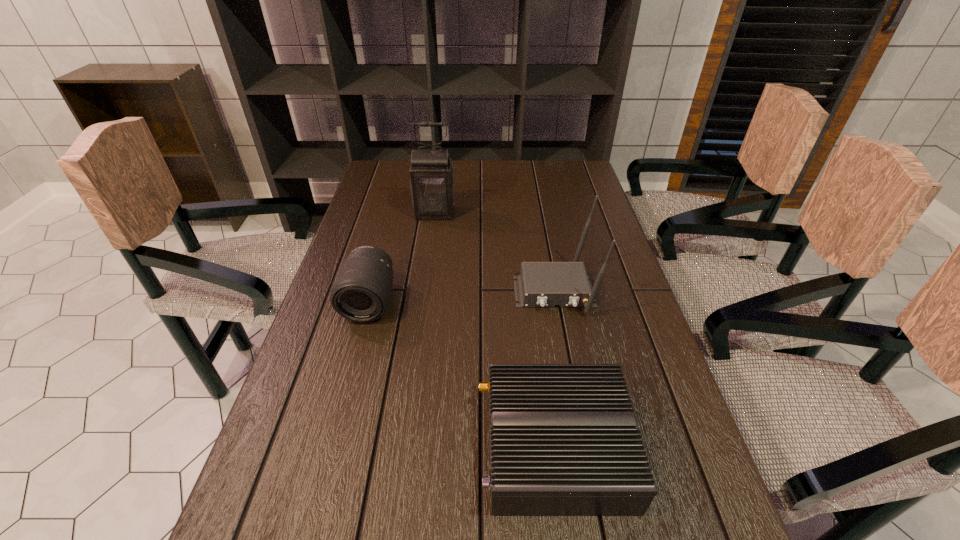
The width and height of the screenshot is (960, 540). Find the location of `vacant space that's between the farther router and the farthest object`. vacant space that's between the farther router and the farthest object is located at coordinates (494, 252).

Locate an element on the screen. The image size is (960, 540). vacant space in between the shortest object and the third object from right to left is located at coordinates (495, 329).

You are a GUI agent. You are given a task and a screenshot of the screen. Output one action in this format:
    pyautogui.click(x=<x>, y=<y>)
    Task: Click on the free space between the nearer router and the third object from right to left
    
    Given the screenshot: What is the action you would take?
    pyautogui.click(x=495, y=329)

Identify the location of free point between the taller router and the third tallest object. This screenshot has width=960, height=540. (462, 296).

This screenshot has width=960, height=540. Find the location of `unoccupied position between the third shortest object and the leftmost object`. unoccupied position between the third shortest object and the leftmost object is located at coordinates (462, 296).

At what (x,y) coordinates should I click in order to perform the action: click on object that stands as the closest to the farthest object. Please return your answer as a coordinate pair (x, y). Image resolution: width=960 pixels, height=540 pixels. Looking at the image, I should click on (361, 292).

The height and width of the screenshot is (540, 960). Find the location of `the second closest object to the second tallest object`. the second closest object to the second tallest object is located at coordinates (432, 184).

Where is `vacant region that satisfies the following two spatial constraints: 1. on the back of the farther router to connect cables; 2. on the back panel of the shorter router`? The image size is (960, 540). vacant region that satisfies the following two spatial constraints: 1. on the back of the farther router to connect cables; 2. on the back panel of the shorter router is located at coordinates (583, 447).